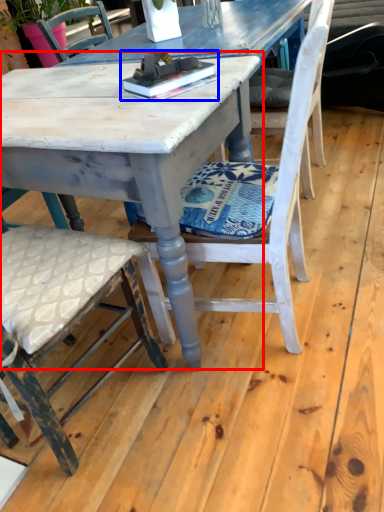
Question: Which object is closer to the camera taking this photo, round table (highlighted by a red box) or book (highlighted by a blue box)?

Choices:
 (A) round table
 (B) book

Answer: (A)